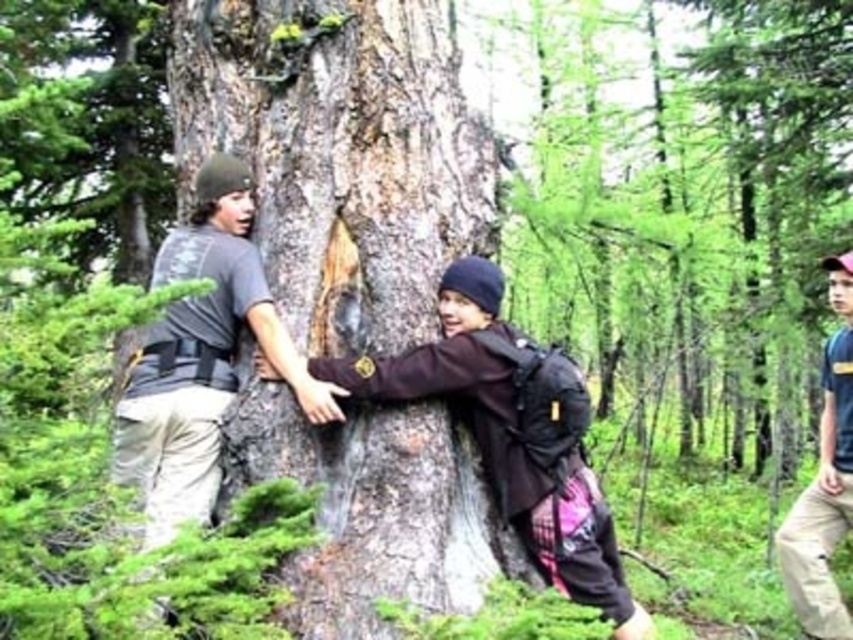
Question: Is dark brown leather jacket at center thinner than blue cotton shirt at right?

Choices:
 (A) no
 (B) yes

Answer: (A)

Question: Is smooth bark tree trunk at center below dark brown leather jacket at center?

Choices:
 (A) no
 (B) yes

Answer: (A)

Question: Considering the real-world distances, which object is farthest from the gray t-shirt at left?

Choices:
 (A) blue cotton shirt at right
 (B) dark brown leather jacket at center
 (C) smooth bark tree trunk at center

Answer: (A)

Question: Estimate the real-world distances between objects in this image. Which object is farther from the blue cotton shirt at right?

Choices:
 (A) gray t-shirt at left
 (B) dark brown leather jacket at center

Answer: (A)

Question: Is smooth bark tree trunk at center to the left of blue cotton shirt at right from the viewer's perspective?

Choices:
 (A) yes
 (B) no

Answer: (A)

Question: Among these points, which one is nearest to the camera?

Choices:
 (A) (805, 568)
 (B) (155, 416)

Answer: (B)